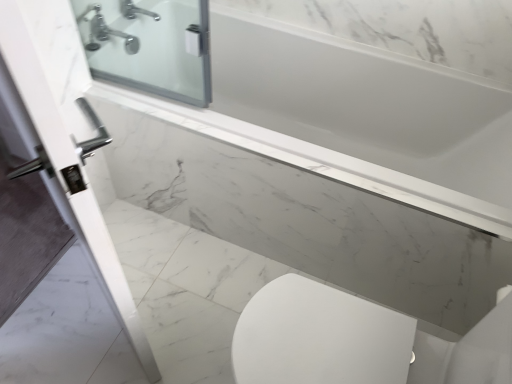
Find the location of a particular element. vacant space underneath white glossy door handle at left (from a real-world perspective) is located at coordinates (110, 311).